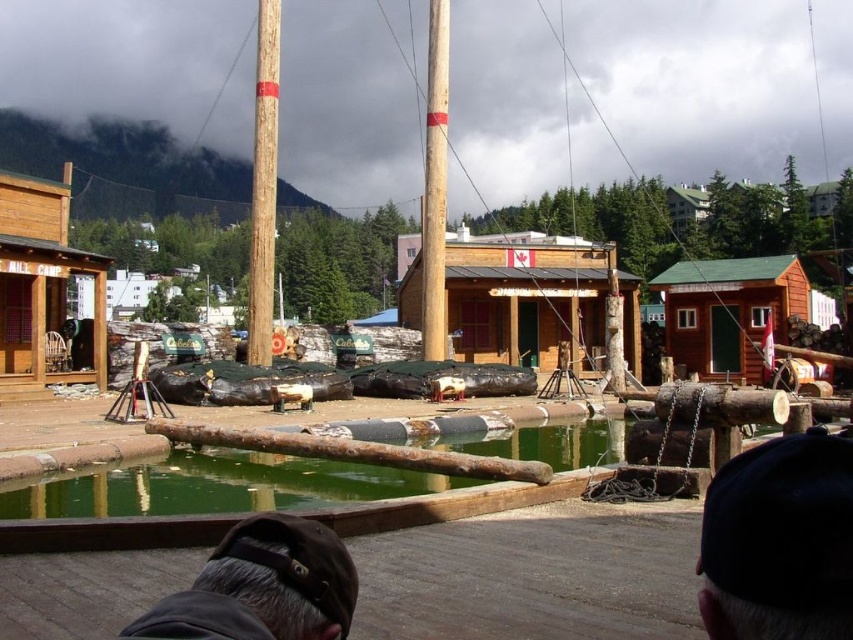
Question: Which of the following is the closest to the observer?

Choices:
 (A) wooden cabin at left
 (B) smooth wooden pole at upper center
 (C) dark brown fabric cap at lower left
 (D) brown wooden cabin at center-right

Answer: (C)

Question: Does dark gray fabric cap at lower right have a lesser width compared to smooth wooden pole at upper center?

Choices:
 (A) no
 (B) yes

Answer: (B)

Question: Is brown wooden cabin at center-right above smooth wooden pole at center?

Choices:
 (A) yes
 (B) no

Answer: (B)

Question: Is the position of wooden cabin at left more distant than that of smooth wooden pole at center?

Choices:
 (A) yes
 (B) no

Answer: (B)

Question: Which of the following is the closest to the observer?

Choices:
 (A) (422, 312)
 (B) (840, 588)
 (C) (265, 262)

Answer: (B)

Question: Which point is closer to the camera?

Choices:
 (A) (57, 292)
 (B) (520, 234)

Answer: (A)